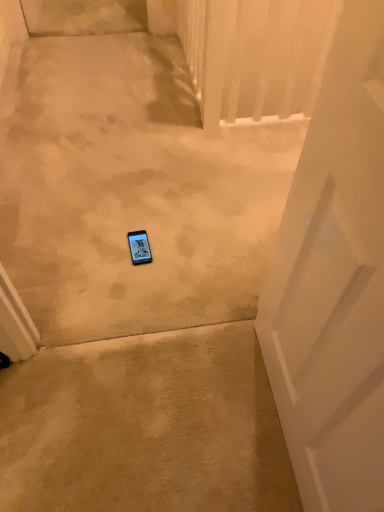
At what (x,y) coordinates should I click in order to perform the action: click on unoccupied area behind matte black phone at center. Please return your answer as a coordinate pair (x, y). This screenshot has width=384, height=512. Looking at the image, I should click on (143, 217).